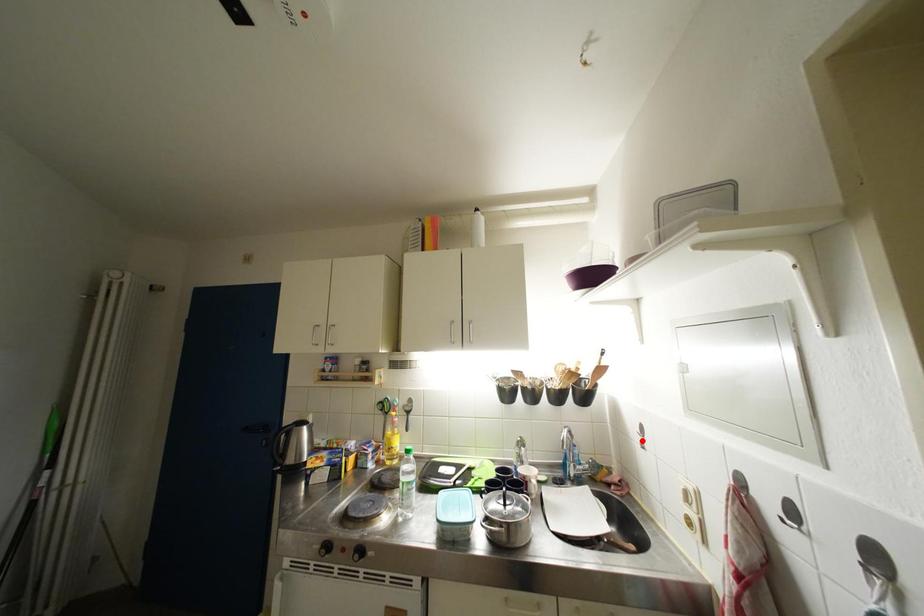
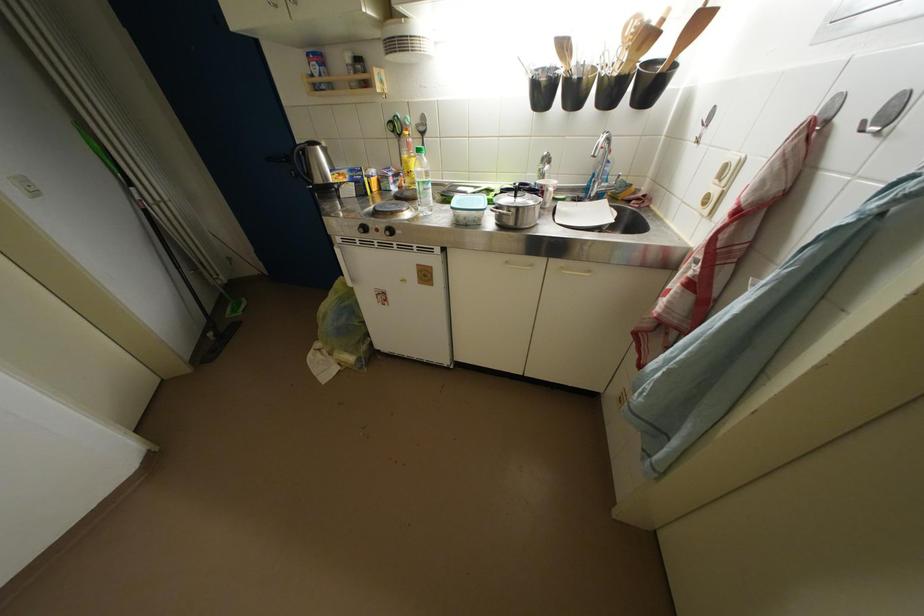
The point at the highlighted location is marked in the first image. Where is the corresponding point in the second image?

(700, 137)